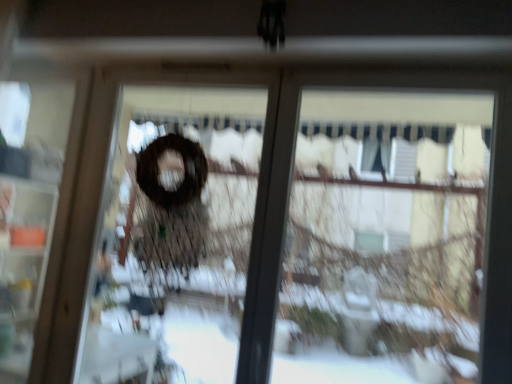
Question: Is brown matte wreath at center, marked as the first screen door in a right-to-left arrangement, situated inside transparent glass at center or outside?

Choices:
 (A) inside
 (B) outside

Answer: (B)

Question: Relative to transparent glass at center, is brown matte wreath at center, marked as the first screen door in a right-to-left arrangement, in front or behind?

Choices:
 (A) behind
 (B) front

Answer: (A)

Question: Considering the real-world distances, which object is farthest from the brown matte wreath at center, arranged as the 2th screen door when viewed from the left?

Choices:
 (A) transparent glass at center
 (B) transparent plastic screen door at left, placed as the 1th screen door when sorted from left to right

Answer: (A)

Question: Estimate the real-world distances between objects in this image. Which object is closer to the transparent plastic screen door at left, the 2th screen door from the right?

Choices:
 (A) transparent glass at center
 (B) brown matte wreath at center, marked as the first screen door in a right-to-left arrangement

Answer: (B)